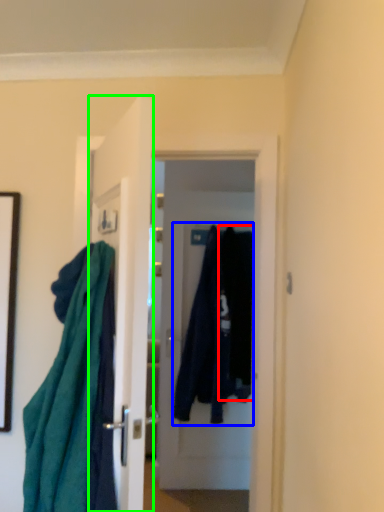
Question: Estimate the real-world distances between objects in this image. Which object is farther from clothing (highlighted by a red box), clothing (highlighted by a blue box) or door (highlighted by a green box)?

Choices:
 (A) clothing
 (B) door

Answer: (B)